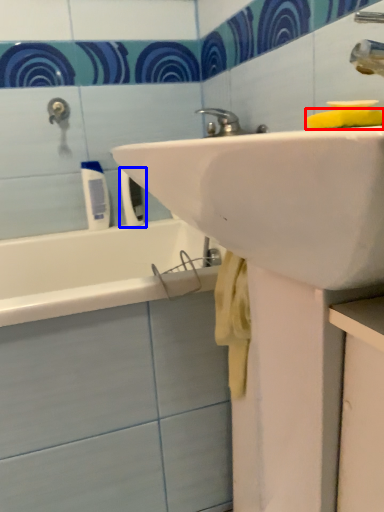
Question: Which point is further to the camera, soap (highlighted by a red box) or toiletry (highlighted by a blue box)?

Choices:
 (A) soap
 (B) toiletry

Answer: (B)